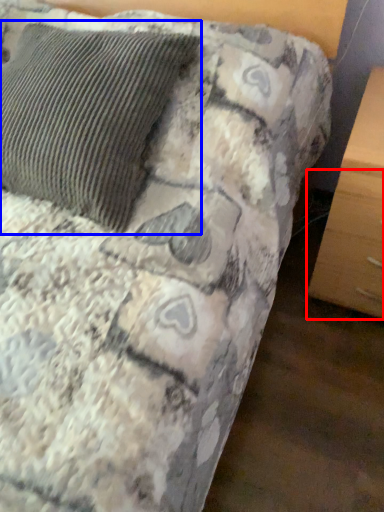
Question: Which point is further to the camera, drawer (highlighted by a red box) or pillow (highlighted by a blue box)?

Choices:
 (A) drawer
 (B) pillow

Answer: (A)